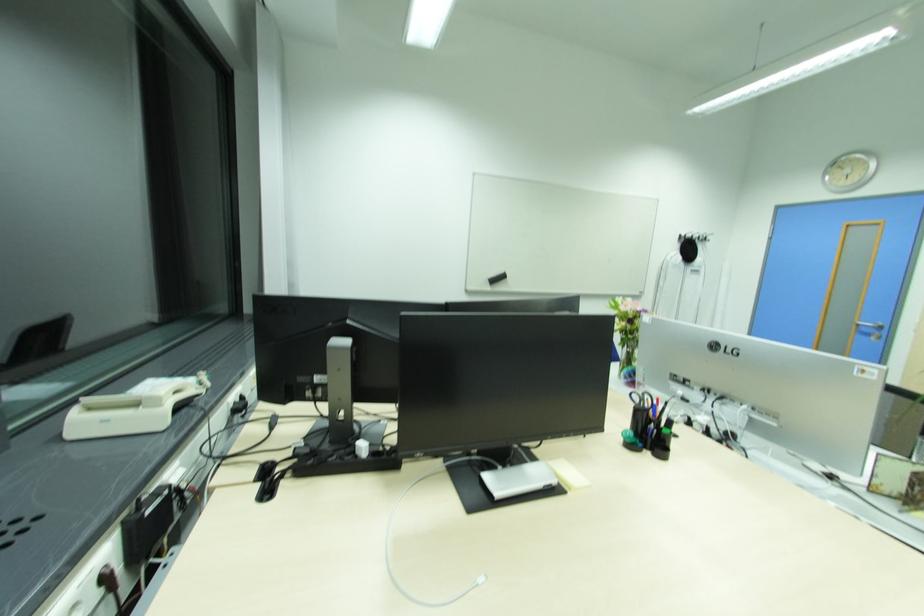
Find where to lift the black pen holder. Please return your answer as a coordinate pair (x, y).

(649, 424)